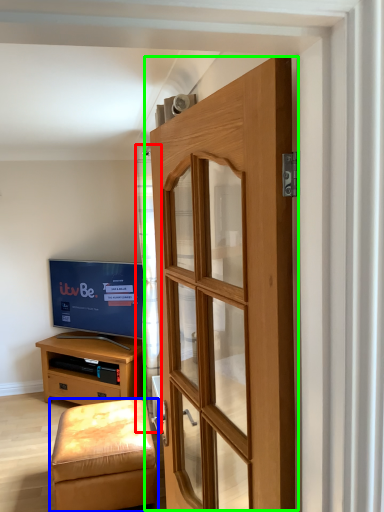
Question: Which object is the farthest from curtain (highlighted by a red box)? Choose among these: stool (highlighted by a blue box) or door (highlighted by a green box).

Choices:
 (A) stool
 (B) door

Answer: (B)